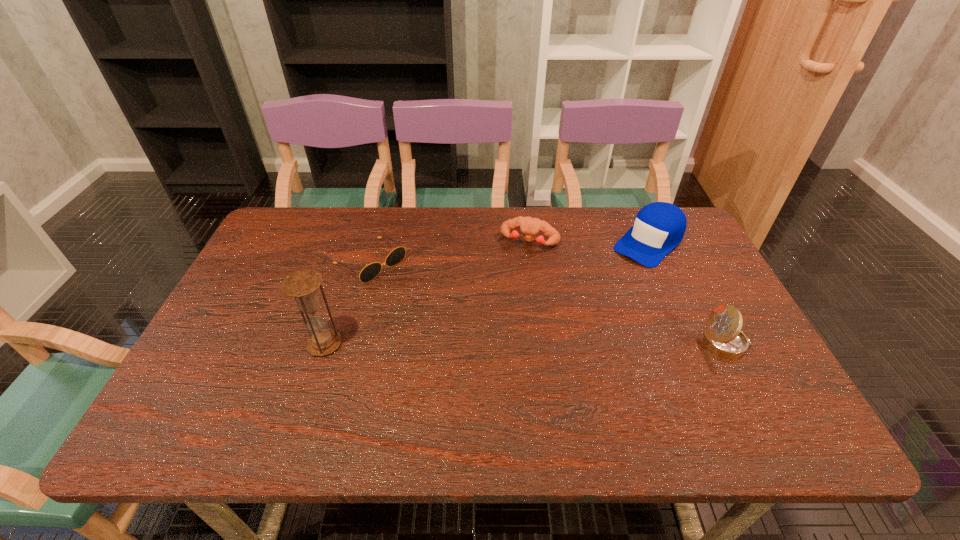
In order to click on vacant spot on the desktop that is between the tallest object and the compass and is positioned on the front-facing side of the sunglasses in this screenshot , I will do `click(485, 344)`.

The image size is (960, 540). In order to click on vacant spot on the desktop that is between the tallest object and the compass and is positioned with the gloves of the second shortest object facing forward in this screenshot , I will do `click(490, 344)`.

The width and height of the screenshot is (960, 540). Find the location of `vacant space on the desktop that is between the tallest object and the compass and is positioned on the front-facing side of the baseball cap`. vacant space on the desktop that is between the tallest object and the compass and is positioned on the front-facing side of the baseball cap is located at coordinates (539, 344).